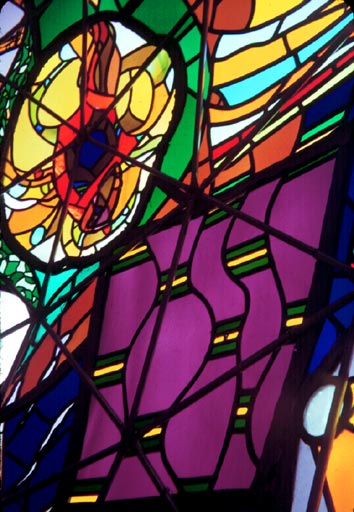
Find the location of `orange glass`. orange glass is located at coordinates pos(270,153), pos(242,167), pos(203,152), pos(81,330), pos(169,203), pos(57,163), pos(73,211), pos(232,9), pos(213,40), pos(197,8).